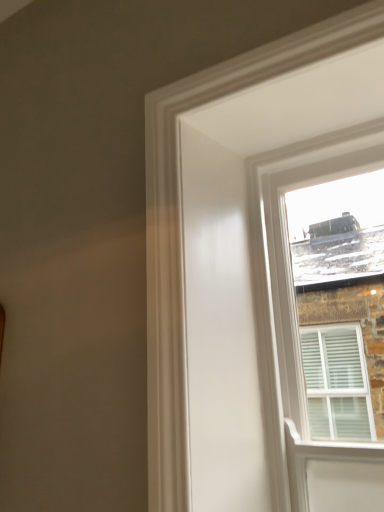
You are a GUI agent. You are given a task and a screenshot of the screen. Output one action in this format:
    pyautogui.click(x=<x>, y=<y>)
    Task: Click on the white glossy window at upper right
    This screenshot has width=384, height=512.
    Given the screenshot: What is the action you would take?
    pyautogui.click(x=182, y=231)

Image resolution: width=384 pixels, height=512 pixels. Describe the element at coordinates (182, 231) in the screenshot. I see `white glossy window at upper right` at that location.

Find the location of a particular element. This screenshot has height=512, width=384. white glossy window at upper right is located at coordinates (182, 231).